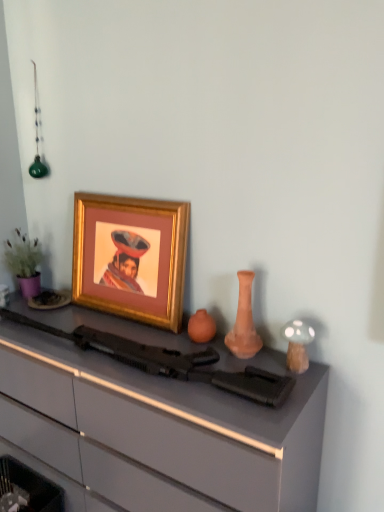
Where is `vacant area that lies between terracotta vase at center and white glossy mushroom at right`? Image resolution: width=384 pixels, height=512 pixels. vacant area that lies between terracotta vase at center and white glossy mushroom at right is located at coordinates (271, 357).